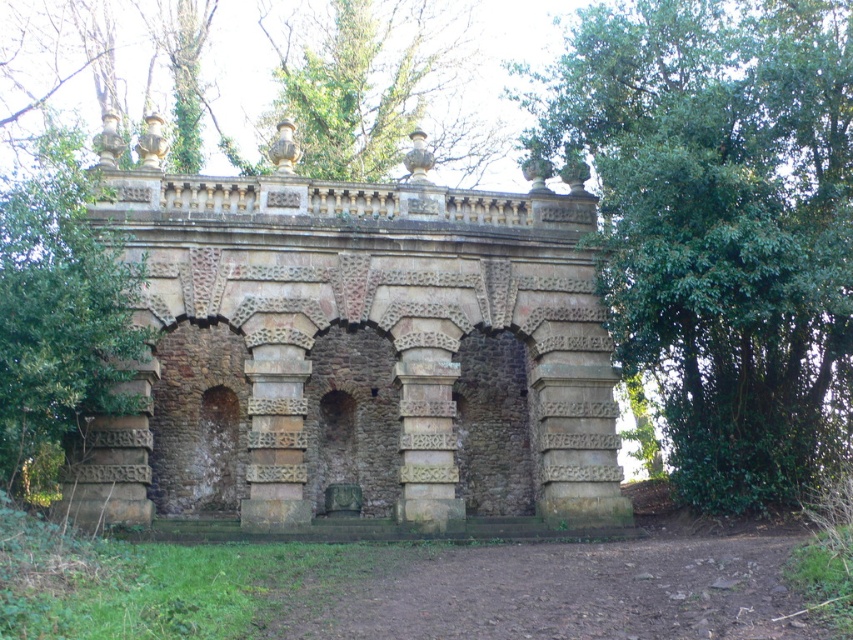
Is green leafy tree at upper right bigger than green leafy tree at upper center?

Yes, green leafy tree at upper right is bigger than green leafy tree at upper center.

Is green leafy tree at upper right below green leafy tree at upper center?

Yes.

Is point (712, 428) closer to camera compared to point (408, 49)?

Yes, point (712, 428) is in front of point (408, 49).

Find the location of a particular element. The width and height of the screenshot is (853, 640). green leafy tree at upper right is located at coordinates (718, 221).

Which is more to the right, brown stone arches at center or green leafy tree at center?

From the viewer's perspective, brown stone arches at center appears more on the right side.

Is brown stone arches at center further to the viewer compared to green leafy tree at center?

Yes, brown stone arches at center is behind green leafy tree at center.

Between point (402, 333) and point (0, 328), which one is positioned in front?

Point (0, 328) is more forward.

The width and height of the screenshot is (853, 640). Find the location of `brown stone arches at center`. brown stone arches at center is located at coordinates (381, 316).

Who is more forward, [68,138] or [222,150]?

Point [68,138] is in front.

In the scene shown: Which is more to the left, green leafy tree at center or green leafy tree at upper center?

green leafy tree at center

Image resolution: width=853 pixels, height=640 pixels. I want to click on green leafy tree at center, so click(59, 320).

You are a GUI agent. You are given a task and a screenshot of the screen. Output one action in this format:
    pyautogui.click(x=<x>, y=<y>)
    Task: Click on the green leafy tree at center
    The image size is (853, 640).
    Given the screenshot: What is the action you would take?
    pyautogui.click(x=59, y=320)